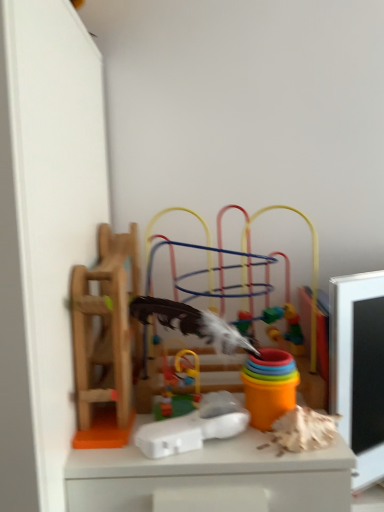
Question: From a real-world perspective, is wooden ladder at left, which is the fourth toy from right to left, physically located above or below white plastic toy at center, which ranks as the 2th toy in right-to-left order?

Choices:
 (A) below
 (B) above

Answer: (B)

Question: Is point (120, 397) positioned closer to the camera than point (200, 444)?

Choices:
 (A) farther
 (B) closer

Answer: (A)

Question: Estimate the real-world distances between objects in this image. Which object is farther from the wooden ladder at left, placed as the 1th toy when sorted from left to right?

Choices:
 (A) multicolored plastic toy at center, the first toy viewed from the right
 (B) white plastic toy at center, which ranks as the third toy in left-to-right order
 (C) rubberized plastic toy at center, which is the third toy from right to left

Answer: (B)

Question: Which object is positioned closest to the rubberized plastic toy at center, which is the third toy from right to left?

Choices:
 (A) white plastic toy at center, which ranks as the third toy in left-to-right order
 (B) wooden ladder at left, placed as the 1th toy when sorted from left to right
 (C) multicolored plastic toy at center, acting as the 4th toy starting from the left

Answer: (A)